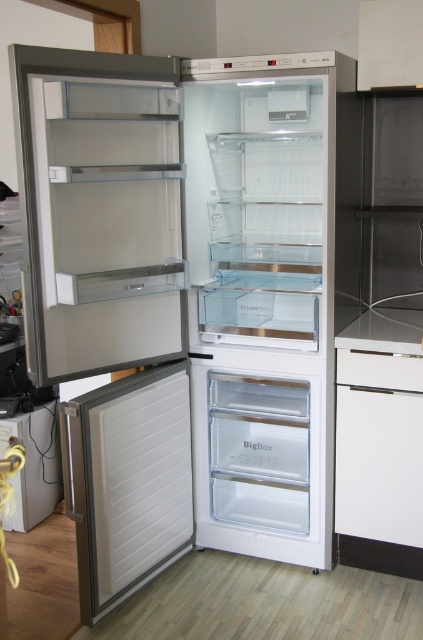
Is white matte door at lower left below transparent plastic drawer at center?

Correct, white matte door at lower left is located below transparent plastic drawer at center.

Which is above, white matte door at lower left or transparent plastic drawer at center?

transparent plastic drawer at center

Is point (147, 468) behind point (285, 525)?

No, it is in front of (285, 525).

Locate an element on the screen. This screenshot has height=640, width=423. white matte door at lower left is located at coordinates (128, 481).

Does transparent plastic drawer at center have a greater height compared to white glossy counter top at lower right?

Yes.

From the picture: Does transparent plastic drawer at center appear on the right side of white glossy counter top at lower right?

In fact, transparent plastic drawer at center is to the left of white glossy counter top at lower right.

Between point (236, 470) and point (401, 339), which one is positioned behind?

Positioned behind is point (236, 470).

The width and height of the screenshot is (423, 640). Identify the location of transparent plastic drawer at center. (257, 464).

Does white matte door at lower left have a greater height compared to white glossy counter top at lower right?

Correct, white matte door at lower left is much taller as white glossy counter top at lower right.

Is the position of white matte door at lower left more distant than that of white glossy counter top at lower right?

No, white matte door at lower left is closer to the viewer.

You are a GUI agent. You are given a task and a screenshot of the screen. Output one action in this format:
    pyautogui.click(x=<x>, y=<y>)
    Task: Click on the white matte door at lower left
    
    Given the screenshot: What is the action you would take?
    pyautogui.click(x=128, y=481)

This screenshot has height=640, width=423. Find the location of `white matte door at lower left`. white matte door at lower left is located at coordinates pos(128,481).